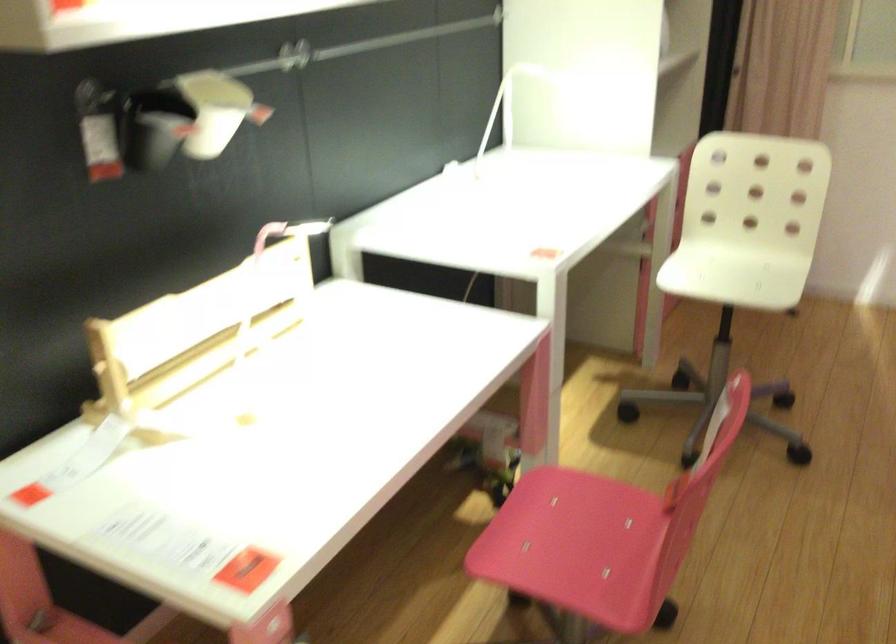
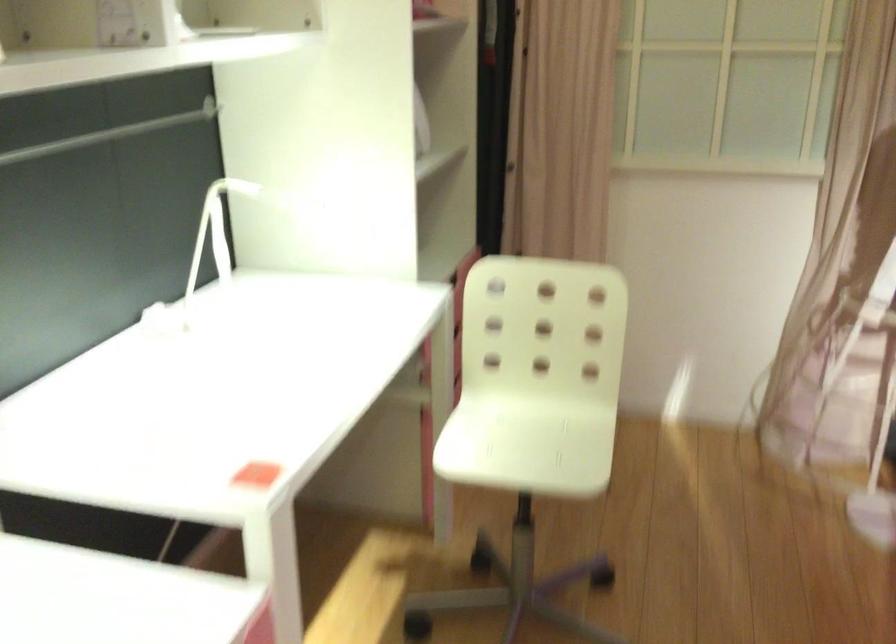
Locate, in the second image, the point that corresponds to point 498,107 in the first image.

(213, 234)